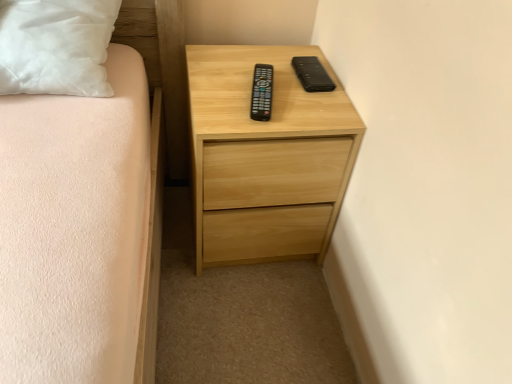
Question: From a real-world perspective, does black matte case at upper right sit lower than natural wood chest of drawers at center?

Choices:
 (A) no
 (B) yes

Answer: (A)

Question: Does black matte case at upper right turn towards natural wood chest of drawers at center?

Choices:
 (A) no
 (B) yes

Answer: (B)

Question: Can you confirm if black matte case at upper right is positioned to the right of natural wood chest of drawers at center?

Choices:
 (A) yes
 (B) no

Answer: (A)

Question: From a real-world perspective, is black matte case at upper right located higher than natural wood chest of drawers at center?

Choices:
 (A) yes
 (B) no

Answer: (A)

Question: Is black matte case at upper right wider than natural wood chest of drawers at center?

Choices:
 (A) yes
 (B) no

Answer: (B)

Question: From the image's perspective, relative to natural wood chest of drawers at center, is black plastic remote at center above or below?

Choices:
 (A) above
 (B) below

Answer: (A)

Question: Is black plastic remote at center bigger or smaller than natural wood chest of drawers at center?

Choices:
 (A) big
 (B) small

Answer: (B)

Question: Is black plastic remote at center wider or thinner than natural wood chest of drawers at center?

Choices:
 (A) thin
 (B) wide

Answer: (A)

Question: Considering their positions, is black plastic remote at center located in front of or behind natural wood chest of drawers at center?

Choices:
 (A) behind
 (B) front

Answer: (A)

Question: In terms of size, does black plastic remote at center appear bigger or smaller than black matte case at upper right?

Choices:
 (A) big
 (B) small

Answer: (A)

Question: Is black plastic remote at center in front of or behind black matte case at upper right in the image?

Choices:
 (A) front
 (B) behind

Answer: (A)

Question: Is black plastic remote at center taller or shorter than black matte case at upper right?

Choices:
 (A) tall
 (B) short

Answer: (A)

Question: Is black plastic remote at center wider or thinner than black matte case at upper right?

Choices:
 (A) wide
 (B) thin

Answer: (A)

Question: Is natural wood chest of drawers at center situated inside black matte case at upper right or outside?

Choices:
 (A) outside
 (B) inside

Answer: (A)

Question: Considering the relative positions of natural wood chest of drawers at center and black matte case at upper right in the image provided, is natural wood chest of drawers at center to the left or to the right of black matte case at upper right?

Choices:
 (A) left
 (B) right

Answer: (A)